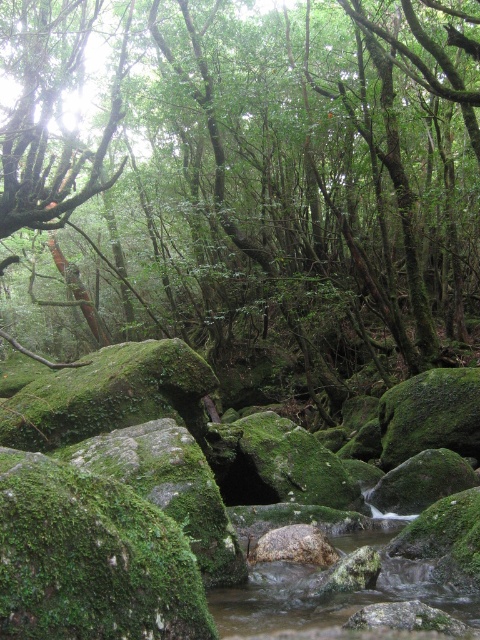
You are a hiker navigating through the forest and want to move from the point closer to you to the point further away. Which path should you take between the two points, point (126, 33) and point (304, 605)?

You should take the path leading towards point (304, 605) because it is further away from you compared to point (126, 33), which is closer.

From the picture: You are a hiker who wants to cross the stream in the forest scene. The green mossy rock at center is in the middle of the stream. If you can jump 8 meters, can you reach the rock from the bank?

The green mossy rock at center is 9.11 meters away from the viewer. Since your jumping distance is 8 meters, you cannot reach the rock as it is farther than your jump capability.

You are a hiker looking at the forest scene. You see the green mossy rock at center. Can you estimate its 2D coordinates in the image?

The green mossy rock at center is located at coordinates approximately 0.291 on the x axis and 0.527 on the y axis.